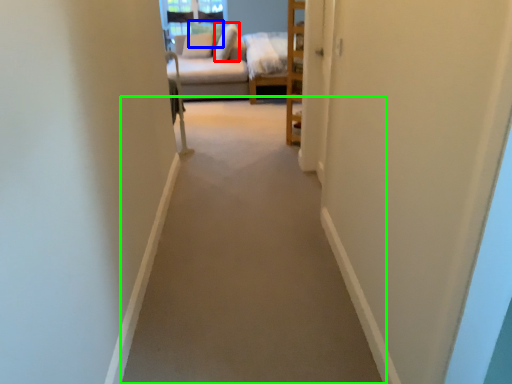
Question: Estimate the real-world distances between objects in this image. Which object is closer to pillow (highlighted by a red box), pillow (highlighted by a blue box) or path (highlighted by a green box)?

Choices:
 (A) pillow
 (B) path

Answer: (A)